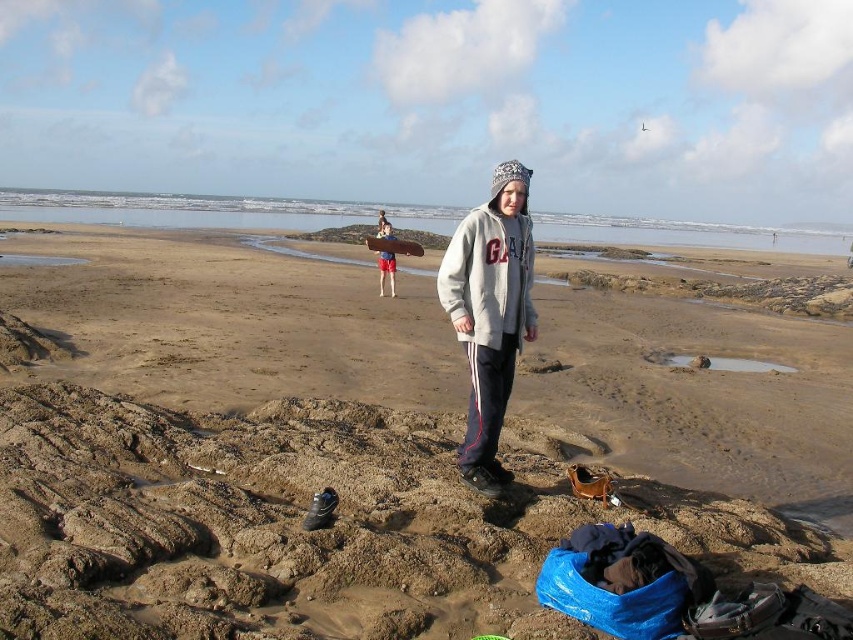
Question: Which is farther from the gray fleece jacket at center?

Choices:
 (A) brown sand at center
 (B) gray fleece sweatshirt at center
 (C) smooth red shorts at center

Answer: (C)

Question: Can you confirm if gray fleece jacket at center is wider than gray fleece sweatshirt at center?

Choices:
 (A) no
 (B) yes

Answer: (B)

Question: Is brown sand at center above gray fleece sweatshirt at center?

Choices:
 (A) no
 (B) yes

Answer: (A)

Question: Which object is positioned farthest from the gray fleece jacket at center?

Choices:
 (A) brown sand at center
 (B) smooth red shorts at center

Answer: (B)

Question: Considering the relative positions of gray fleece jacket at center and smooth red shorts at center in the image provided, where is gray fleece jacket at center located with respect to smooth red shorts at center?

Choices:
 (A) below
 (B) above

Answer: (A)

Question: Which point is closer to the camera taking this photo?

Choices:
 (A) (24, 301)
 (B) (387, 276)
 (C) (480, 237)

Answer: (C)